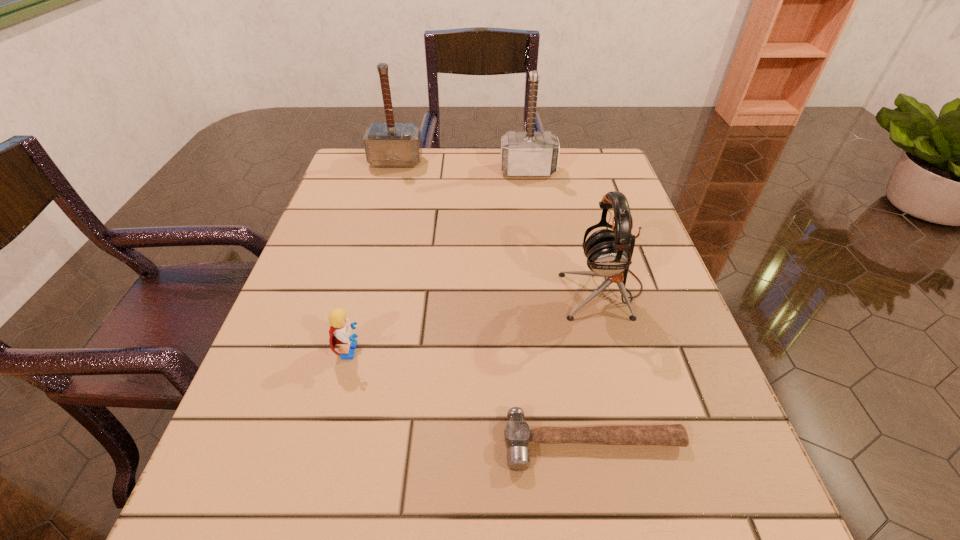
You are a GUI agent. You are given a task and a screenshot of the screen. Output one action in this format:
    pyautogui.click(x=<x>, y=<y>)
    Task: Click on the hammer that stands as the second closest to the shortest object
    This screenshot has height=540, width=960.
    Given the screenshot: What is the action you would take?
    pyautogui.click(x=391, y=144)

Choose which hammer is the second nearest neighbor to the leftmost hammer. Please provide its 2D coordinates. Your answer should be formatted as a tuple, i.e. [(x, y)], where the tuple contains the x and y coordinates of a point satisfying the conditions above.

[(517, 433)]

I want to click on vacant position in the image that satisfies the following two spatial constraints: 1. on the front side of the leftmost hammer; 2. on the right side of the earphone, so click(362, 289).

This screenshot has width=960, height=540. In order to click on vacant space that satisfies the following two spatial constraints: 1. on the front side of the earphone; 2. on the front-facing side of the fourth tallest object in this screenshot , I will do click(619, 350).